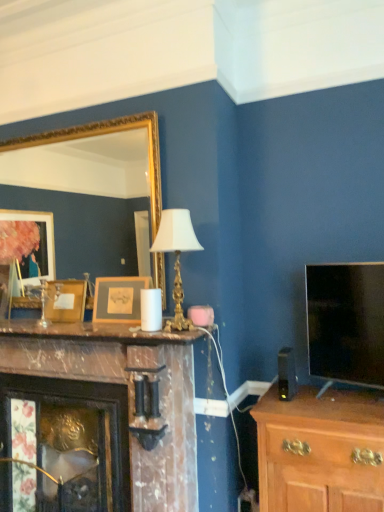
Locate an element on the screen. The height and width of the screenshot is (512, 384). gold metallic table lamp at center is located at coordinates (176, 256).

This screenshot has height=512, width=384. What do you see at coordinates (320, 451) in the screenshot?
I see `wooden chest of drawers at lower right` at bounding box center [320, 451].

Image resolution: width=384 pixels, height=512 pixels. Find the location of `wooden chest of drawers at lower right`. wooden chest of drawers at lower right is located at coordinates 320,451.

Where is `gold-framed mirror at upper left`? The image size is (384, 512). gold-framed mirror at upper left is located at coordinates (105, 134).

The height and width of the screenshot is (512, 384). Describe the element at coordinates (96, 419) in the screenshot. I see `marble fireplace at center` at that location.

Find the location of a particular element. This screenshot has height=512, width=384. gold metallic table lamp at center is located at coordinates (176, 256).

Image resolution: width=384 pixels, height=512 pixels. What are the coordinates of `television on the right of gold metallic table lamp at center` in the screenshot? It's located at (346, 322).

In terms of size, does gold metallic table lamp at center appear bigger or smaller than flat-screen tv at right?

In the image, gold metallic table lamp at center appears to be smaller than flat-screen tv at right.

Based on their positions, is gold metallic table lamp at center located to the left or right of flat-screen tv at right?

In the image, gold metallic table lamp at center appears on the left side of flat-screen tv at right.

Is gold metallic table lamp at center positioned with its back to flat-screen tv at right?

gold metallic table lamp at center does not have its back to flat-screen tv at right.

From the image's perspective, is gold metallic table lamp at center positioned above or below wooden picture frame at center, acting as the first picture frame starting from the right?

From the image's perspective, gold metallic table lamp at center appears above wooden picture frame at center, acting as the first picture frame starting from the right.

Does gold metallic table lamp at center appear on the left side of wooden picture frame at center, arranged as the first picture frame when viewed from the front?

In fact, gold metallic table lamp at center is to the right of wooden picture frame at center, arranged as the first picture frame when viewed from the front.

From a real-world perspective, which is physically below, gold metallic table lamp at center or wooden picture frame at center, the second picture frame positioned from the back?

From a 3D spatial view, wooden picture frame at center, the second picture frame positioned from the back, is below.

Image resolution: width=384 pixels, height=512 pixels. I want to click on table lamp above the wooden picture frame at center, which is the 2th picture frame from left to right (from a real-world perspective), so click(x=176, y=256).

Is wooden chest of drawers at lower right bigger or smaller than marble fireplace at center?

In the image, wooden chest of drawers at lower right appears to be smaller than marble fireplace at center.

Is there a large distance between wooden chest of drawers at lower right and marble fireplace at center?

No, wooden chest of drawers at lower right is in close proximity to marble fireplace at center.

Find the location of a particular element. This screenshot has height=512, width=384. chest of drawers in front of the marble fireplace at center is located at coordinates (320, 451).

Considering the positions of objects wooden chest of drawers at lower right and marble fireplace at center in the image provided, who is in front, wooden chest of drawers at lower right or marble fireplace at center?

wooden chest of drawers at lower right.

How different are the orientations of wooden chest of drawers at lower right and wooden picture frame at center, the second picture frame positioned from the back, in degrees?

The angular difference between wooden chest of drawers at lower right and wooden picture frame at center, the second picture frame positioned from the back, is 1.09 degrees.

Could you tell me if wooden chest of drawers at lower right is turned towards wooden picture frame at center, arranged as the first picture frame when viewed from the front?

No, wooden chest of drawers at lower right is not turned towards wooden picture frame at center, arranged as the first picture frame when viewed from the front.

Is wooden chest of drawers at lower right behind wooden picture frame at center, arranged as the first picture frame when viewed from the front?

No, it is not.

Looking at their sizes, would you say wooden chest of drawers at lower right is wider or thinner than wooden picture frame at center, acting as the first picture frame starting from the right?

Clearly, wooden chest of drawers at lower right has more width compared to wooden picture frame at center, acting as the first picture frame starting from the right.

Is gold metallic table lamp at center bigger or smaller than wooden picture frame at center-left, which ranks as the 2th picture frame in front-to-back order?

gold metallic table lamp at center is bigger than wooden picture frame at center-left, which ranks as the 2th picture frame in front-to-back order.

Which object is positioned more to the right, gold metallic table lamp at center or wooden picture frame at center-left, which ranks as the 2th picture frame in front-to-back order?

gold metallic table lamp at center is more to the right.

Which object is more forward, gold metallic table lamp at center or wooden picture frame at center-left, arranged as the first picture frame when viewed from the left?

gold metallic table lamp at center.

Which is behind, wooden picture frame at center, arranged as the first picture frame when viewed from the front, or wooden picture frame at center-left, acting as the 1th picture frame starting from the back?

wooden picture frame at center-left, acting as the 1th picture frame starting from the back, is more distant.

From a real-world perspective, between wooden picture frame at center, the second picture frame positioned from the back, and wooden picture frame at center-left, acting as the second picture frame starting from the right, who is vertically lower?

wooden picture frame at center-left, acting as the second picture frame starting from the right, is physically lower.

Can you confirm if wooden picture frame at center, arranged as the first picture frame when viewed from the front, is bigger than wooden picture frame at center-left, which ranks as the 2th picture frame in front-to-back order?

Indeed, wooden picture frame at center, arranged as the first picture frame when viewed from the front, has a larger size compared to wooden picture frame at center-left, which ranks as the 2th picture frame in front-to-back order.

Is flat-screen tv at right facing towards gold-framed mirror at upper left?

No, flat-screen tv at right is not turned towards gold-framed mirror at upper left.

Consider the image. From a real-world perspective, is flat-screen tv at right under gold-framed mirror at upper left?

Correct, in the physical world, flat-screen tv at right is lower than gold-framed mirror at upper left.

Can gold-framed mirror at upper left be found inside flat-screen tv at right?

No.

How different are the orientations of flat-screen tv at right and gold-framed mirror at upper left in degrees?

They differ by 20 degrees in their facing directions.

Find the location of a particular element. table lamp positioned vertically above the flat-screen tv at right (from a real-world perspective) is located at coordinates (176, 256).

The width and height of the screenshot is (384, 512). What are the coordinates of `table lamp located in front of the wooden picture frame at center, arranged as the first picture frame when viewed from the front` in the screenshot? It's located at (176, 256).

From the image, which object appears to be farther from marble fireplace at center, wooden picture frame at center, the second picture frame positioned from the back, or gold metallic table lamp at center?

Based on the image, gold metallic table lamp at center appears to be further to marble fireplace at center.

Which object lies further to the anchor point flat-screen tv at right, wooden picture frame at center-left, acting as the second picture frame starting from the right, or marble mantel at center?

Among the two, wooden picture frame at center-left, acting as the second picture frame starting from the right, is located further to flat-screen tv at right.

When comparing their distances from marble fireplace at center, does wooden chest of drawers at lower right or wooden picture frame at center-left, acting as the second picture frame starting from the right, seem closer?

wooden picture frame at center-left, acting as the second picture frame starting from the right, lies closer to marble fireplace at center than the other object.

From the image, which object appears to be farther from marble mantel at center, flat-screen tv at right or gold metallic table lamp at center?

Among the two, flat-screen tv at right is located further to marble mantel at center.

Considering their positions, is gold metallic table lamp at center positioned further to gold-framed mirror at upper left than marble fireplace at center?

Based on the image, marble fireplace at center appears to be further to gold-framed mirror at upper left.

Estimate the real-world distances between objects in this image. Which object is further from wooden picture frame at center-left, which ranks as the 2th picture frame in front-to-back order, marble mantel at center or marble fireplace at center?

Among the two, marble fireplace at center is located further to wooden picture frame at center-left, which ranks as the 2th picture frame in front-to-back order.

Which object lies nearer to the anchor point marble mantel at center, wooden picture frame at center-left, acting as the second picture frame starting from the right, or gold metallic table lamp at center?

wooden picture frame at center-left, acting as the second picture frame starting from the right, is closer to marble mantel at center.

Which object lies further to the anchor point marble fireplace at center, marble mantel at center or wooden picture frame at center-left, acting as the second picture frame starting from the right?

The object further to marble fireplace at center is wooden picture frame at center-left, acting as the second picture frame starting from the right.

Image resolution: width=384 pixels, height=512 pixels. Find the location of `picture frame between gold-framed mirror at upper left and gold metallic table lamp at center`. picture frame between gold-framed mirror at upper left and gold metallic table lamp at center is located at coordinates (119, 298).

The width and height of the screenshot is (384, 512). I want to click on mirror situated between marble fireplace at center and flat-screen tv at right from left to right, so click(x=105, y=134).

In order to click on chest of drawers between wooden picture frame at center-left, acting as the 1th picture frame starting from the back, and flat-screen tv at right, in the horizontal direction in this screenshot , I will do `click(320, 451)`.

Image resolution: width=384 pixels, height=512 pixels. Find the location of `picture frame situated between gold-framed mirror at upper left and flat-screen tv at right from left to right`. picture frame situated between gold-framed mirror at upper left and flat-screen tv at right from left to right is located at coordinates (119, 298).